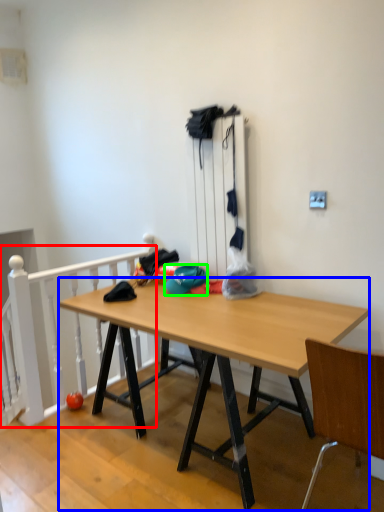
Question: Considering the real-world distances, which object is closest to rail (highlighted by a red box)? desk (highlighted by a blue box) or hat (highlighted by a green box).

Choices:
 (A) desk
 (B) hat

Answer: (A)